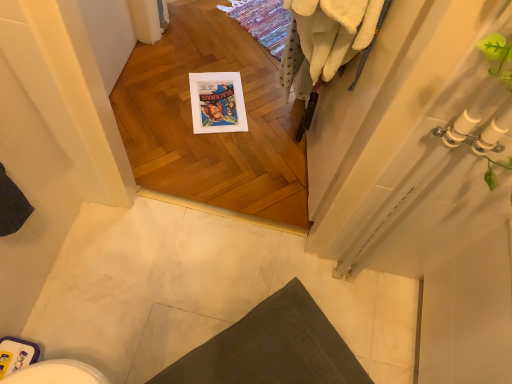
Where is `free location to the left of dark gray fabric bath mat at lower center`? free location to the left of dark gray fabric bath mat at lower center is located at coordinates (150, 300).